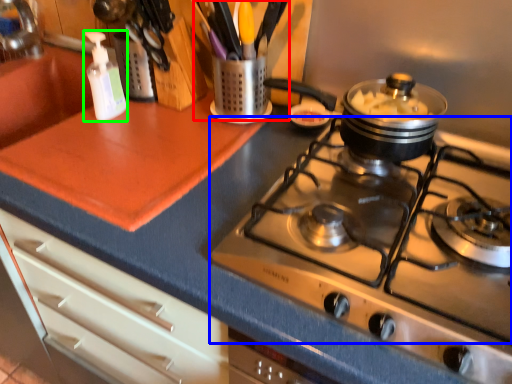
Question: Estimate the real-world distances between objects in this image. Which object is closer to appliance (highlighted by a red box), gas stove (highlighted by a blue box) or bottle (highlighted by a green box)?

Choices:
 (A) gas stove
 (B) bottle

Answer: (B)